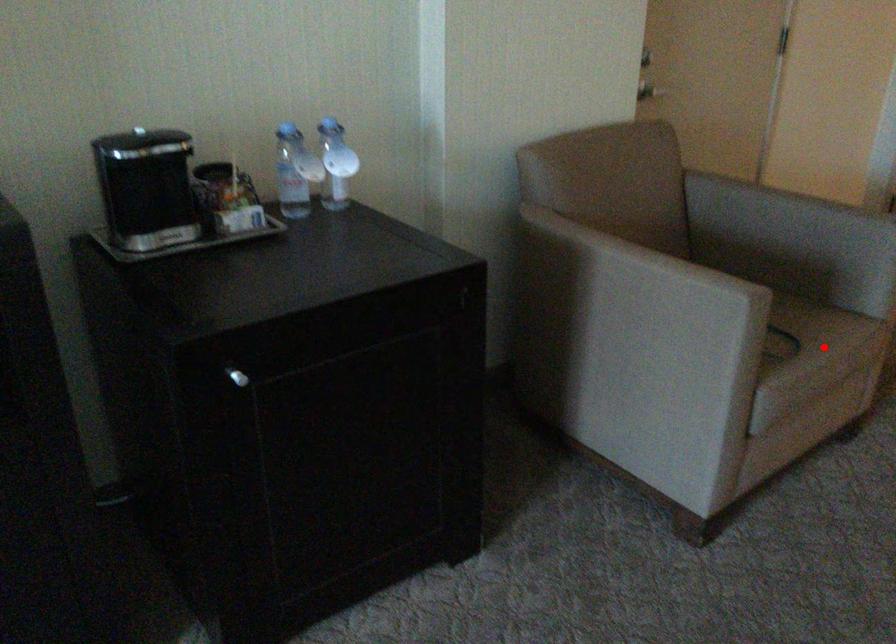
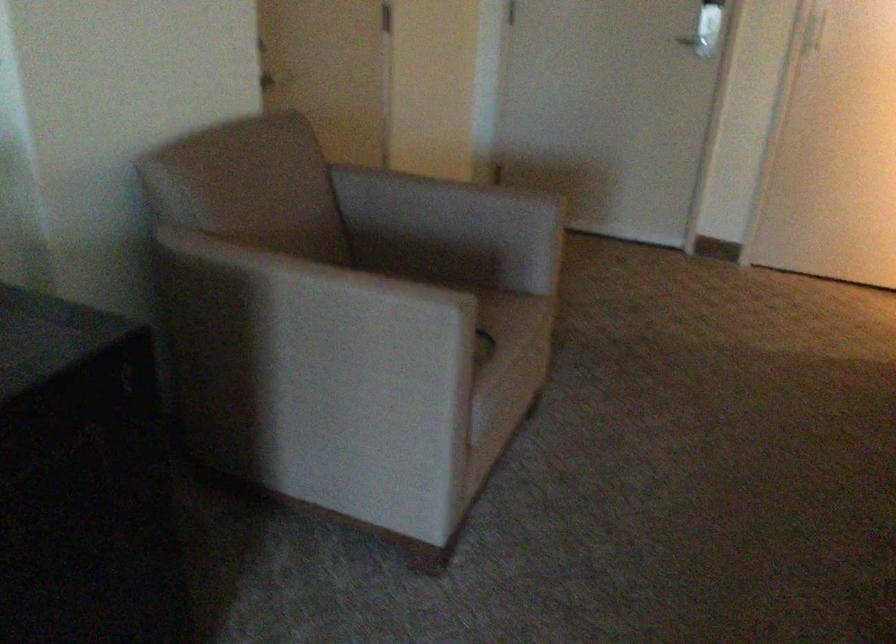
In the second image, find the point that corresponds to the highlighted location in the first image.

(513, 345)